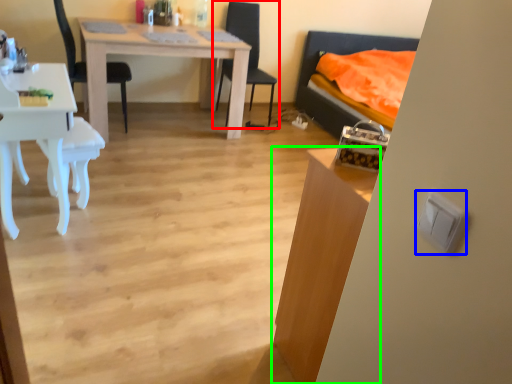
Question: Which object is positioned closest to chair (highlighted by a red box)? Select from light switch (highlighted by a blue box) and table (highlighted by a green box).

Choices:
 (A) light switch
 (B) table

Answer: (B)